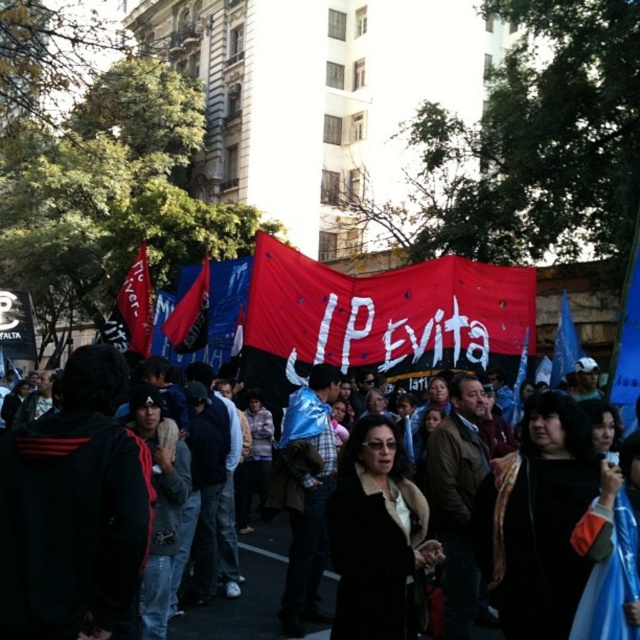
From the picture: You are a photographer trying to capture the protest scene. You notice two items at the center of the image, the black fabric banner at center and the red fabric flag at center. Which one do you think is wider when viewed from your current position?

The black fabric banner at center might be wider than red fabric flag at center.

You are a photographer planning to capture a wide shot of the protest scene. You need to ensure both the red fabric banner at center and the red fabric flag at left are fully visible in your frame. Given their sizes, which object should you prioritize positioning closer to the camera to avoid cropping?

The red fabric flag at left should be positioned closer to the camera since it is smaller in width compared to the red fabric banner at center. This ensures both objects are fully visible without cropping.

You are a photographer standing at the edge of the protest crowd. You want to capture a photo of the red fabric banner at center from your current position. Considering the distance between you and the banner, would you need a telephoto lens to get a clear, closeup shot of the banner?

The red fabric banner at center is 47.14 meters away from the viewer. A telephoto lens is necessary to capture a clear, closeup shot of the banner from this distance.